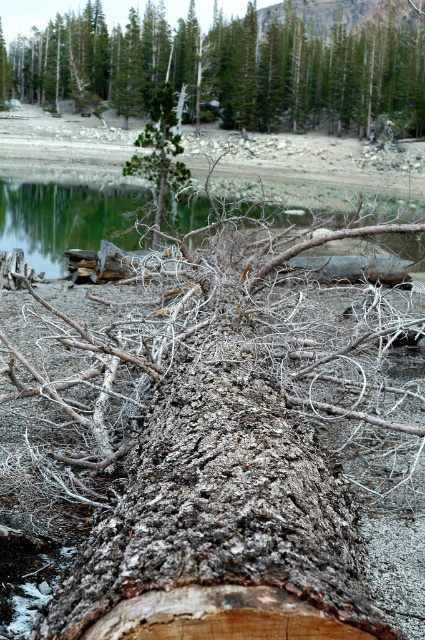
Question: Which point is farther to the camera?

Choices:
 (A) gray rough bark log at center
 (B) clear water at center
 (C) gray rough bark tree trunk at center

Answer: (A)

Question: Does gray rough bark tree trunk at center come in front of clear water at center?

Choices:
 (A) no
 (B) yes

Answer: (B)

Question: Is gray rough bark tree trunk at center positioned before clear water at center?

Choices:
 (A) no
 (B) yes

Answer: (B)

Question: Does gray rough bark tree trunk at center appear on the left side of clear water at center?

Choices:
 (A) yes
 (B) no

Answer: (A)

Question: Estimate the real-world distances between objects in this image. Which object is farther from the gray rough bark tree trunk at center?

Choices:
 (A) gray rough bark log at center
 (B) green matte tree at center

Answer: (A)

Question: Which of the following is the closest to the observer?

Choices:
 (A) (62, 72)
 (B) (319, 573)

Answer: (B)